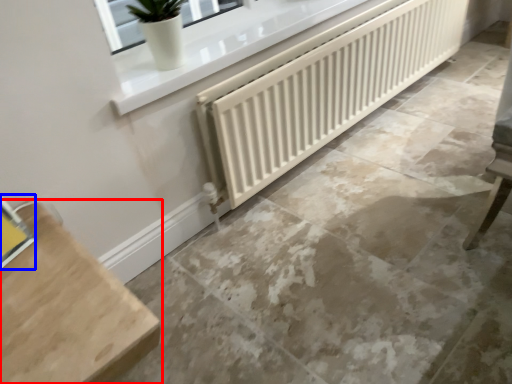
Question: Which point is further to the camera, furniture (highlighted by a red box) or window (highlighted by a blue box)?

Choices:
 (A) furniture
 (B) window

Answer: (B)